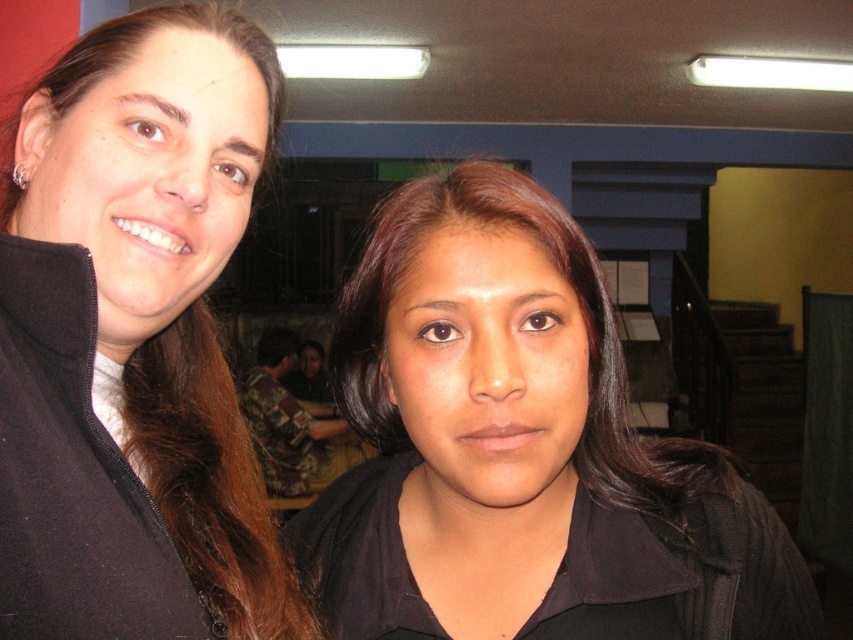
Question: Can you confirm if black matte jacket at center is smaller than matte black jacket at left?

Choices:
 (A) yes
 (B) no

Answer: (A)

Question: Can you confirm if black matte jacket at center is thinner than matte black jacket at left?

Choices:
 (A) yes
 (B) no

Answer: (B)

Question: Among these points, which one is nearest to the camera?

Choices:
 (A) (508, 394)
 (B) (229, 198)

Answer: (A)

Question: In this image, where is black matte jacket at center located relative to matte black jacket at left?

Choices:
 (A) left
 (B) right

Answer: (B)

Question: Among these points, which one is farthest from the camera?

Choices:
 (A) (426, 531)
 (B) (200, 426)

Answer: (B)